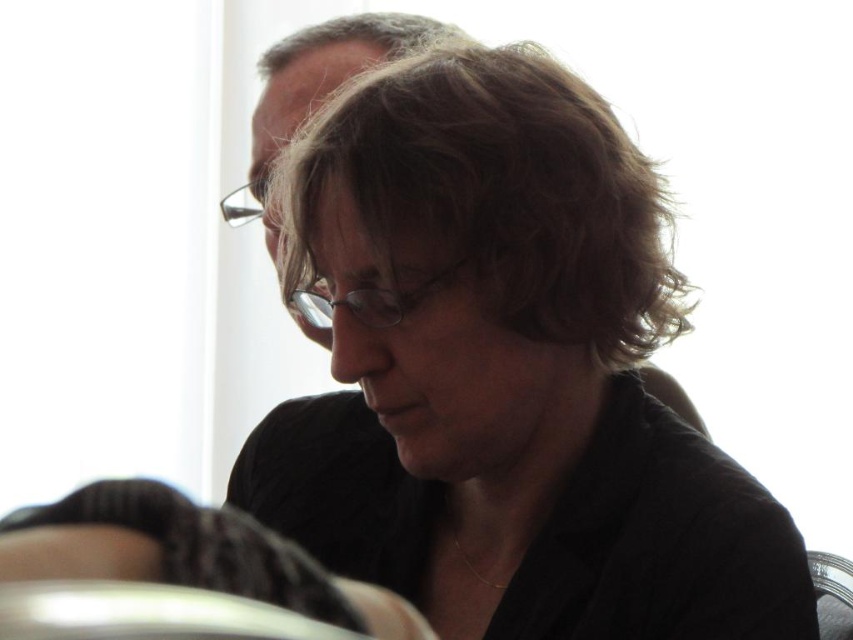
In the scene shown: Is matte black shirt at center thinner than clear plastic glasses at upper center?

In fact, matte black shirt at center might be wider than clear plastic glasses at upper center.

Which of these two, matte black shirt at center or clear plastic glasses at upper center, stands shorter?

clear plastic glasses at upper center

At what (x,y) coordinates should I click in order to perform the action: click on matte black shirt at center. Please return your answer as a coordinate pair (x, y). Looking at the image, I should click on (508, 374).

Between matte black shirt at center and clear plastic glasses at center, which one appears on the right side from the viewer's perspective?

matte black shirt at center is more to the right.

Does matte black shirt at center have a smaller size compared to clear plastic glasses at center?

Actually, matte black shirt at center might be larger than clear plastic glasses at center.

The height and width of the screenshot is (640, 853). What are the coordinates of `matte black shirt at center` in the screenshot? It's located at (508, 374).

Image resolution: width=853 pixels, height=640 pixels. In order to click on matte black shirt at center in this screenshot , I will do `click(508, 374)`.

Who is more forward, [338,564] or [561,314]?

Positioned in front is point [561,314].

Does matte black shirt at center have a greater width compared to brown matte hair at center?

Correct, the width of matte black shirt at center exceeds that of brown matte hair at center.

The height and width of the screenshot is (640, 853). I want to click on matte black shirt at center, so click(x=508, y=374).